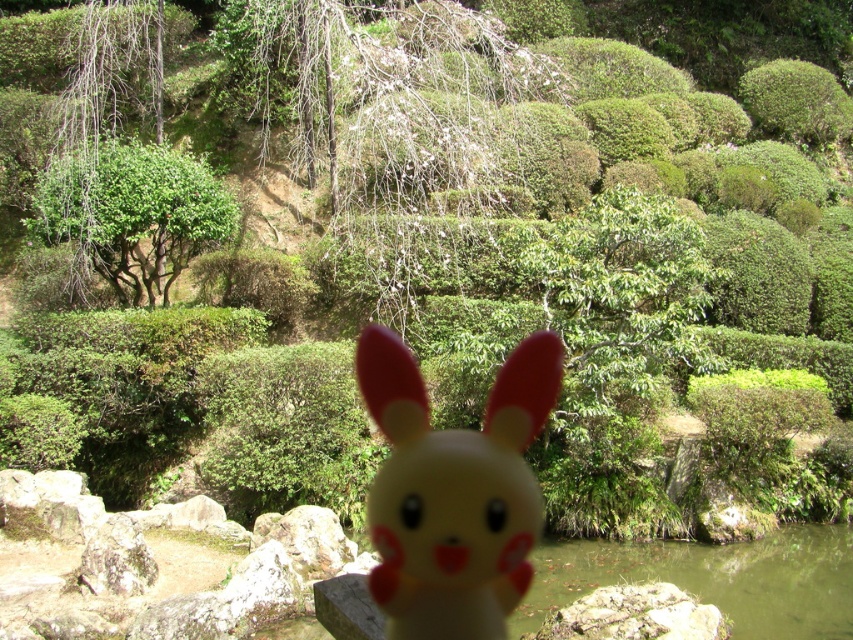
Is the position of yellow matte plastic bunny at center more distant than that of green leafy tree at left?

That is False.

Does point (473, 435) come behind point (82, 28)?

No.

At what (x,y) coordinates should I click in order to perform the action: click on yellow matte plastic bunny at center. Please return your answer as a coordinate pair (x, y). Looking at the image, I should click on (454, 492).

Is yellow matte plastic bunny at center smaller than green leafy bush at upper left?

Correct, yellow matte plastic bunny at center occupies less space than green leafy bush at upper left.

Is yellow matte plastic bunny at center shorter than green leafy bush at upper left?

Yes.

Who is more distant from viewer, [486,612] or [120,216]?

The point [120,216] is behind.

Identify the location of yellow matte plastic bunny at center. (454, 492).

Can you confirm if green leafy bush at upper left is shorter than green leafy tree at left?

Indeed, green leafy bush at upper left has a lesser height compared to green leafy tree at left.

Is green leafy bush at upper left closer to the viewer compared to green leafy tree at left?

Yes, green leafy bush at upper left is in front of green leafy tree at left.

Who is more distant from viewer, (167,163) or (96,243)?

The point (167,163) is behind.

Identify the location of green leafy bush at upper left. (134, 212).